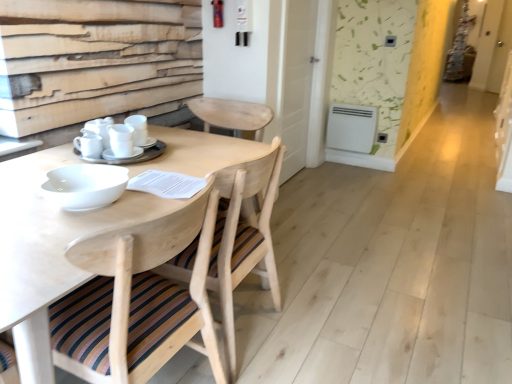
Find the location of a particular element. vacant region to the left of white matte cups at center, placed as the second tableware when sorted from right to left is located at coordinates (38, 159).